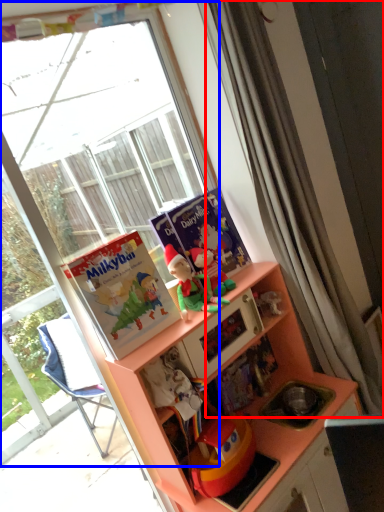
Question: Among these objects, which one is nearest to the camera, curtain (highlighted by a red box) or window (highlighted by a blue box)?

Choices:
 (A) curtain
 (B) window

Answer: (B)